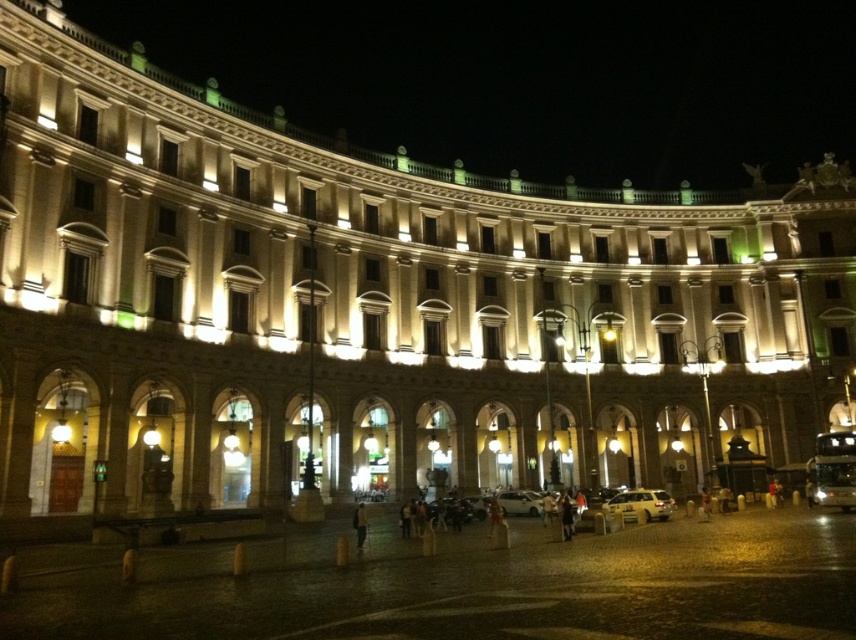
Who is more distant from viewer, (669, 516) or (496, 499)?

The point (496, 499) is behind.

Which of these two, yellow metallic car at lower right or white matte car at center, stands shorter?

With less height is white matte car at center.

Is point (645, 515) positioned after point (516, 508)?

That is False.

This screenshot has height=640, width=856. I want to click on yellow metallic car at lower right, so click(x=642, y=502).

What do you see at coordinates (520, 502) in the screenshot? I see `white matte car at center` at bounding box center [520, 502].

Between point (502, 506) and point (355, 506), which one is positioned in front?

Positioned in front is point (355, 506).

Does point (521, 502) come in front of point (354, 522)?

No, (521, 502) is further to viewer.

Where is `white matte car at center`? Image resolution: width=856 pixels, height=640 pixels. white matte car at center is located at coordinates (520, 502).

How distant is yellow metallic car at lower right from dark brown leather jacket at center?

yellow metallic car at lower right is 72.93 feet away from dark brown leather jacket at center.

Is point (660, 508) positioned in front of point (357, 538)?

No, (660, 508) is behind (357, 538).

Is point (619, 509) positioned behind point (363, 504)?

No, (619, 509) is in front of (363, 504).

Identify the location of yellow metallic car at lower right. This screenshot has height=640, width=856. (642, 502).